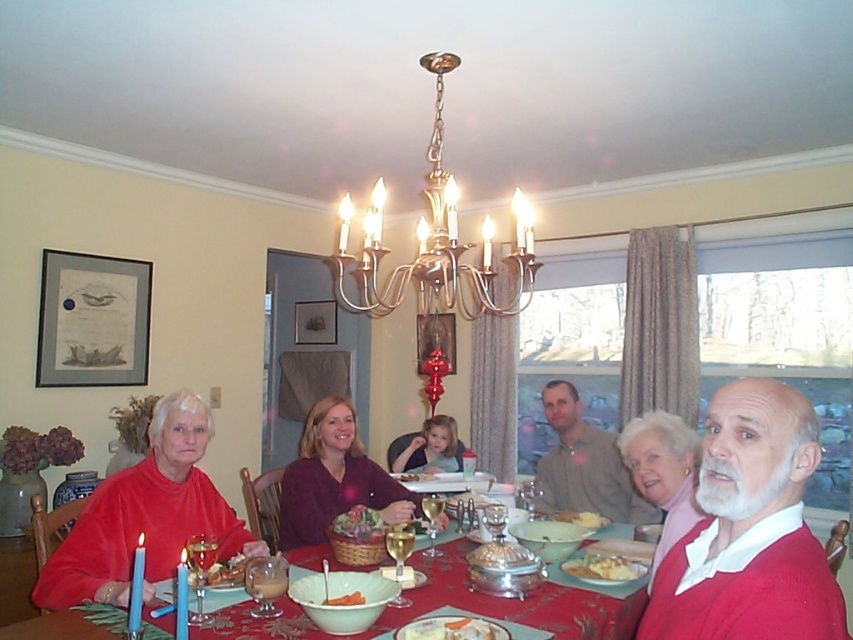
You are a guest at this family gathering and want to retrieve your sweater. You see the matte red sweater at lower left and the matte purple sweater at center. Which one is positioned higher up?

A: The matte red sweater at lower left is located above the matte purple sweater at center, so it is positioned higher up.

You are standing in the dining room and want to reach the point marked as point (461, 637). There is an obstacle at point (202, 492). Can you walk directly to your destination without going around the obstacle?

Point (202, 492) is behind point (461, 637), so you can walk directly to point (461, 637) without needing to go around the obstacle at point (202, 492).